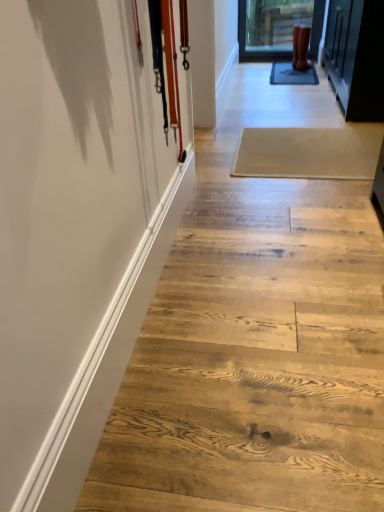
Question: Is rubber matte boots at upper right bigger than white glossy barn door at left?

Choices:
 (A) yes
 (B) no

Answer: (B)

Question: Does rubber matte boots at upper right lie in front of white glossy barn door at left?

Choices:
 (A) no
 (B) yes

Answer: (A)

Question: Does rubber matte boots at upper right contain white glossy barn door at left?

Choices:
 (A) no
 (B) yes

Answer: (A)

Question: Is rubber matte boots at upper right at the right side of white glossy barn door at left?

Choices:
 (A) no
 (B) yes

Answer: (B)

Question: Can you confirm if rubber matte boots at upper right is wider than white glossy barn door at left?

Choices:
 (A) no
 (B) yes

Answer: (B)

Question: From the image's perspective, is white glossy barn door at left located above or below rubber matte boots at upper right?

Choices:
 (A) above
 (B) below

Answer: (B)

Question: Considering their positions, is white glossy barn door at left located in front of or behind rubber matte boots at upper right?

Choices:
 (A) front
 (B) behind

Answer: (A)

Question: Considering the positions of point (139, 324) and point (296, 55), is point (139, 324) closer or farther from the camera than point (296, 55)?

Choices:
 (A) farther
 (B) closer

Answer: (B)

Question: Based on their positions, is white glossy barn door at left located to the left or right of rubber matte boots at upper right?

Choices:
 (A) left
 (B) right

Answer: (A)

Question: From the image's perspective, relative to natural wood stairs at center, is beige wood plank at center above or below?

Choices:
 (A) above
 (B) below

Answer: (B)

Question: Considering the positions of beige wood plank at center and natural wood stairs at center in the image, is beige wood plank at center taller or shorter than natural wood stairs at center?

Choices:
 (A) short
 (B) tall

Answer: (A)

Question: Considering the positions of beige wood plank at center and natural wood stairs at center in the image, is beige wood plank at center wider or thinner than natural wood stairs at center?

Choices:
 (A) wide
 (B) thin

Answer: (B)

Question: Visually, is beige wood plank at center positioned to the left or to the right of natural wood stairs at center?

Choices:
 (A) left
 (B) right

Answer: (A)

Question: Looking at their shapes, would you say natural wood stairs at center is wider or thinner than rubber matte boots at upper right?

Choices:
 (A) wide
 (B) thin

Answer: (A)

Question: From a real-world perspective, is natural wood stairs at center physically located above or below rubber matte boots at upper right?

Choices:
 (A) above
 (B) below

Answer: (B)